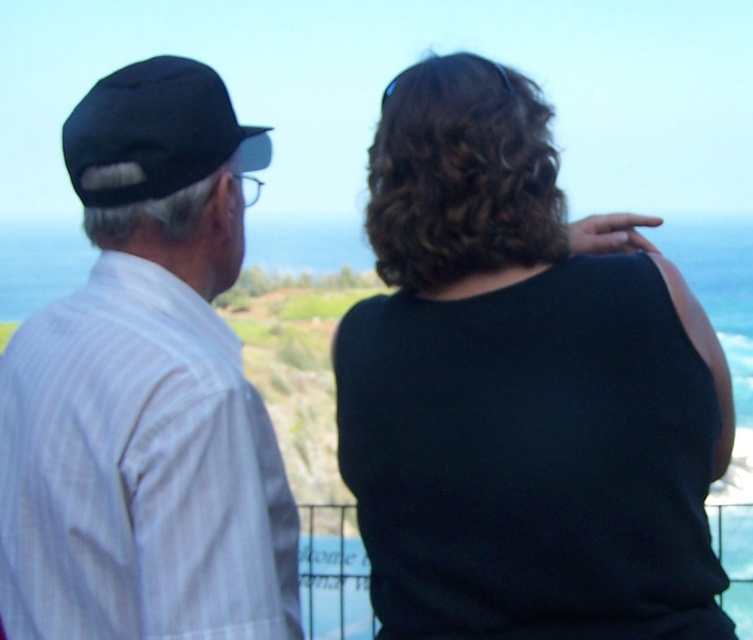
You are standing at the point with coordinates point (139, 115) and want to walk to the point with coordinates point (712, 420). According to the scene, which direction should you move to reach your destination?

To reach point (712, 420) from point (139, 115), you should move forward since point (712, 420) is in front of point (139, 115).

You are a photographer trying to capture the scenic view of the blue water at upper center while ensuring the black fabric baseball cap at left doesn not block the view. Based on their positions, can you determine if the cap will obstruct the view of the water?

The blue water at upper center is taller than the black fabric baseball cap at left, so the cap will not obstruct the view of the water since it is shorter in height.

You are a photographer trying to capture a candid shot of the two people in the image. You want to ensure that both the black matte shirt at upper right and the black fabric baseball cap at left are clearly visible in the frame. Given their sizes, which object might you need to adjust your focus on to ensure it doesn

The black matte shirt at upper right has a lesser width compared to the black fabric baseball cap at left, so you may need to focus more on the smaller black matte shirt at upper right to ensure it is clearly visible in the frame.